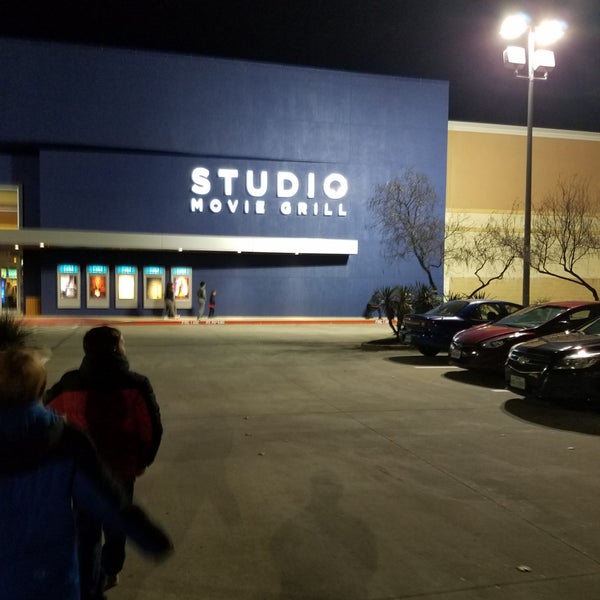
Identify the location of movie poster. (68, 282), (93, 283), (123, 284), (152, 295), (183, 285).